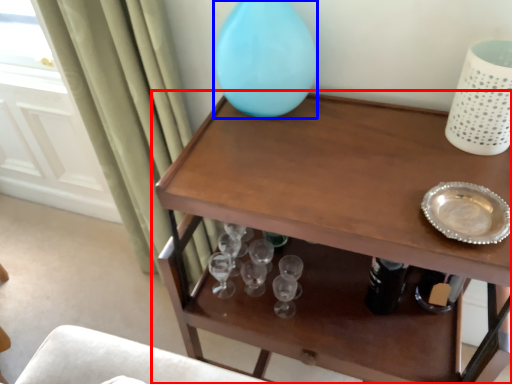
Question: Which object is closer to the camera taking this photo, table (highlighted by a red box) or vase (highlighted by a blue box)?

Choices:
 (A) table
 (B) vase

Answer: (A)